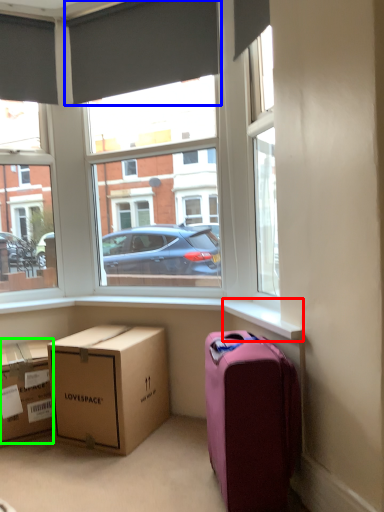
Question: Which object is positioned closest to window sill (highlighted by a red box)? Select from curtain (highlighted by a blue box) and box (highlighted by a green box).

Choices:
 (A) curtain
 (B) box

Answer: (B)